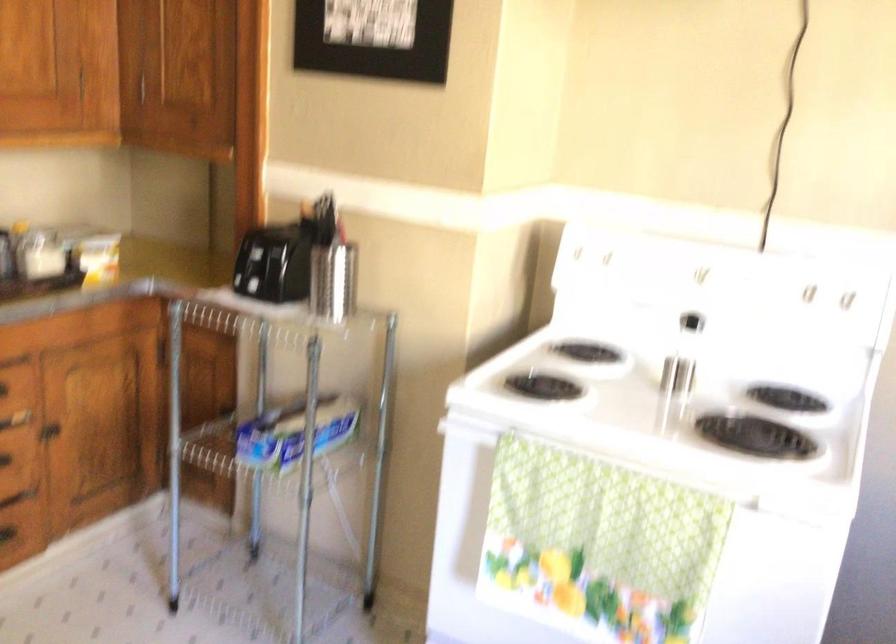
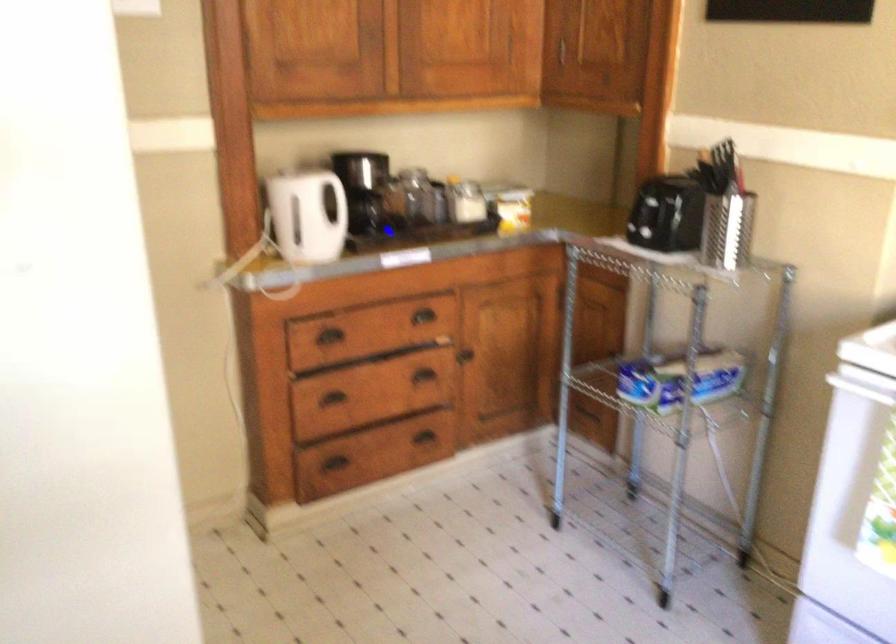
Question: The camera is either moving clockwise (left) or counter-clockwise (right) around the object. The first image is from the beginning of the video and the second image is from the end. Is the camera moving left or right when shooting the video?

Choices:
 (A) Left
 (B) Right

Answer: (B)